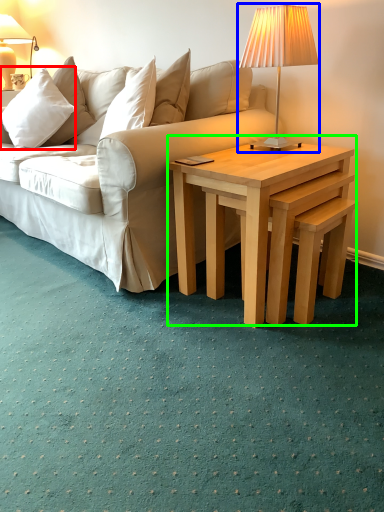
Question: Based on their relative distances, which object is farther from pillow (highlighted by a red box)? Choose from lamp (highlighted by a blue box) and coffee table (highlighted by a green box).

Choices:
 (A) lamp
 (B) coffee table

Answer: (B)